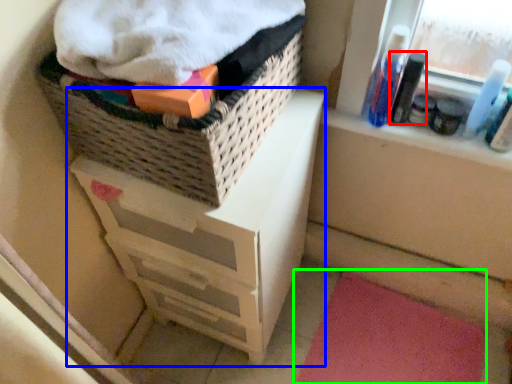
Question: Which object is positioned closest to mouthwash (highlighted by a red box)? Select from chest of drawers (highlighted by a blue box) and bath mat (highlighted by a green box).

Choices:
 (A) chest of drawers
 (B) bath mat

Answer: (A)